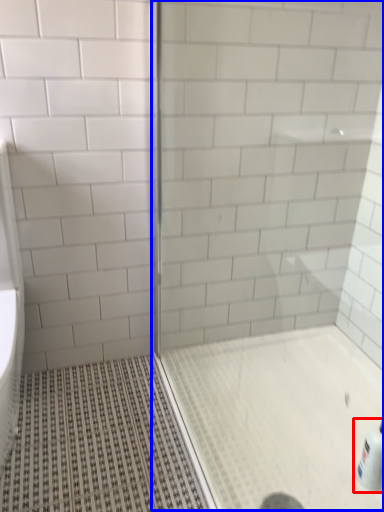
Question: Which object is closer to the camera taking this photo, bottle (highlighted by a red box) or screen door (highlighted by a blue box)?

Choices:
 (A) bottle
 (B) screen door

Answer: (B)